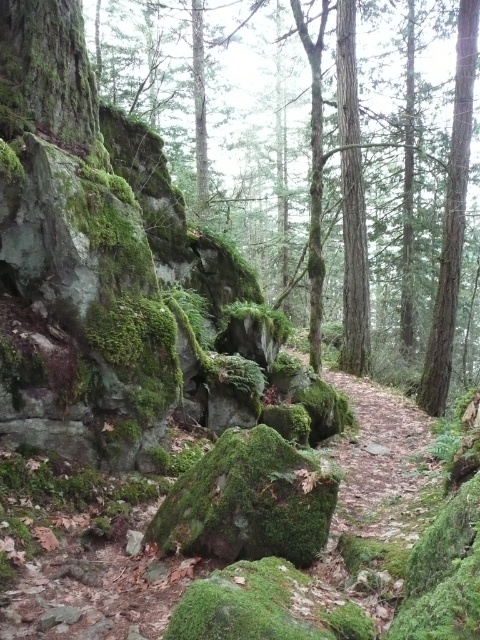
You are standing at the camera position and want to take a photo of the green mossy rock at center. If your camera has a maximum focus range of 4 meters, will it be able to capture the rock clearly?

The green mossy rock at center and camera are 4.51 meters apart from each other. Since the distance exceeds the camera maximum focus range of 4 meters, the camera cannot capture the rock clearly.

You are standing on the dirt path in the forest scene and see two points marked in the image. Which point is closer to you, point (432,342) or point (344,490)?

Point (344,490) is closer to you because it is less further to the viewer than point (432,342) according to the description.

You are a hiker trying to cross the brown dirt path at center. There is a green mossy rock at center blocking your way. Can you step over the rock without needing to climb?

The green mossy rock at center is taller than the brown dirt path at center. Since the rock is higher, you would need to climb over it to cross the path.